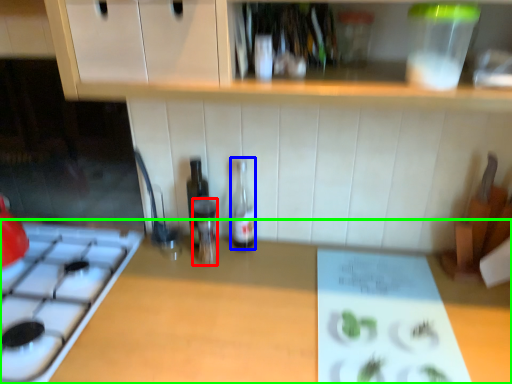
Question: Estimate the real-world distances between objects in this image. Which object is closer to bottle (highlighted by a red box), bottle (highlighted by a blue box) or countertop (highlighted by a green box)?

Choices:
 (A) bottle
 (B) countertop

Answer: (A)